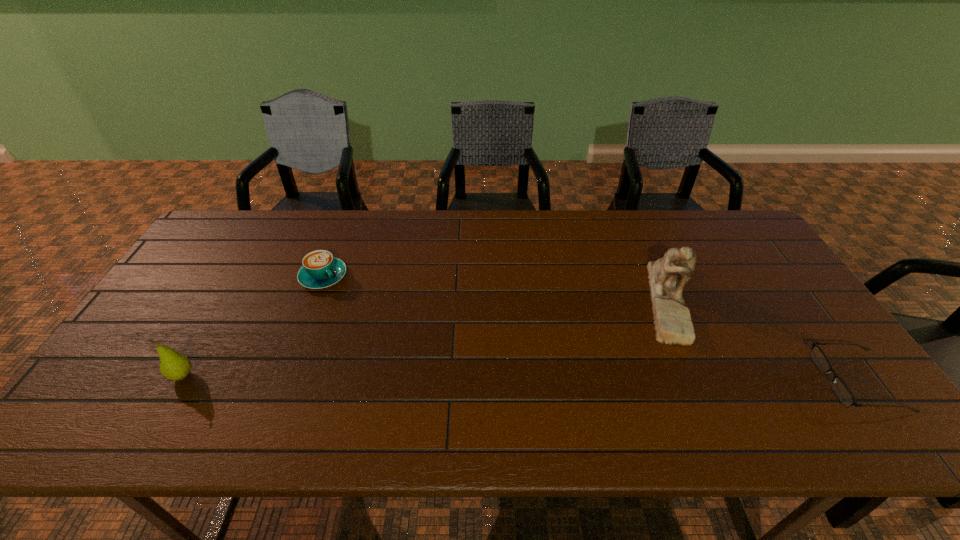
This screenshot has width=960, height=540. I want to click on vacant space in between the rightmost object and the leftmost object, so click(520, 378).

Identify the location of free area in between the pear and the spectacles. (520, 378).

Find the location of `free space between the third object from right to left and the rightmost object`. free space between the third object from right to left and the rightmost object is located at coordinates (590, 329).

I want to click on unoccupied position between the pear and the tallest object, so click(425, 338).

What are the coordinates of `free spot between the second tallest object and the shortest object` in the screenshot? It's located at [x=520, y=378].

I want to click on vacant space in between the spectacles and the tallest object, so click(763, 340).

Identify the location of free area in between the third object from left to right and the pear. (425, 338).

Locate an element on the screen. The width and height of the screenshot is (960, 540). vacant area that lies between the rightmost object and the third shortest object is located at coordinates (520, 378).

This screenshot has width=960, height=540. In order to click on object that ranks as the third closest to the pear in this screenshot , I will do click(x=841, y=390).

You are a GUI agent. You are given a task and a screenshot of the screen. Output one action in this format:
    pyautogui.click(x=<x>, y=<y>)
    Task: Click on the object that is the second closest one to the figurine
    This screenshot has width=960, height=540.
    Given the screenshot: What is the action you would take?
    pyautogui.click(x=320, y=269)